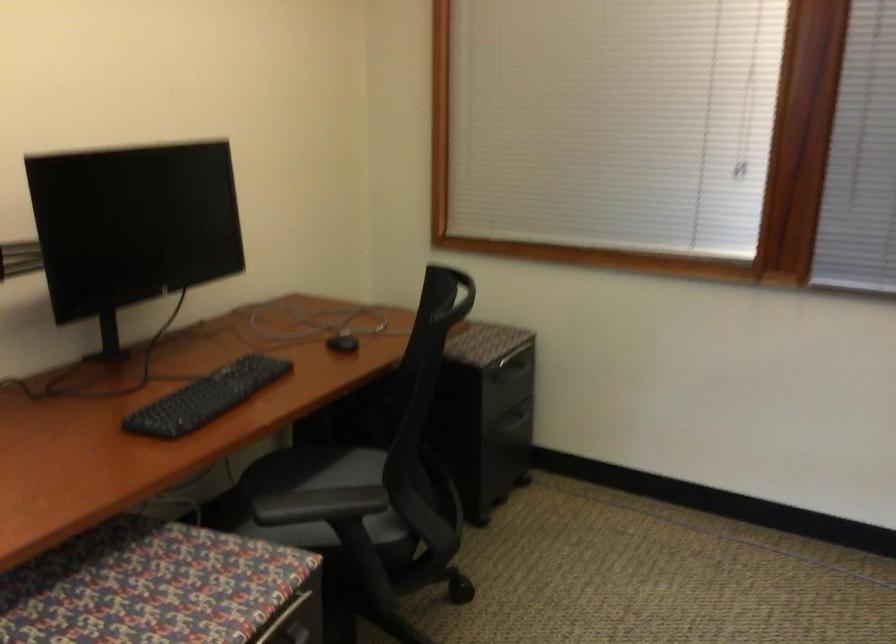
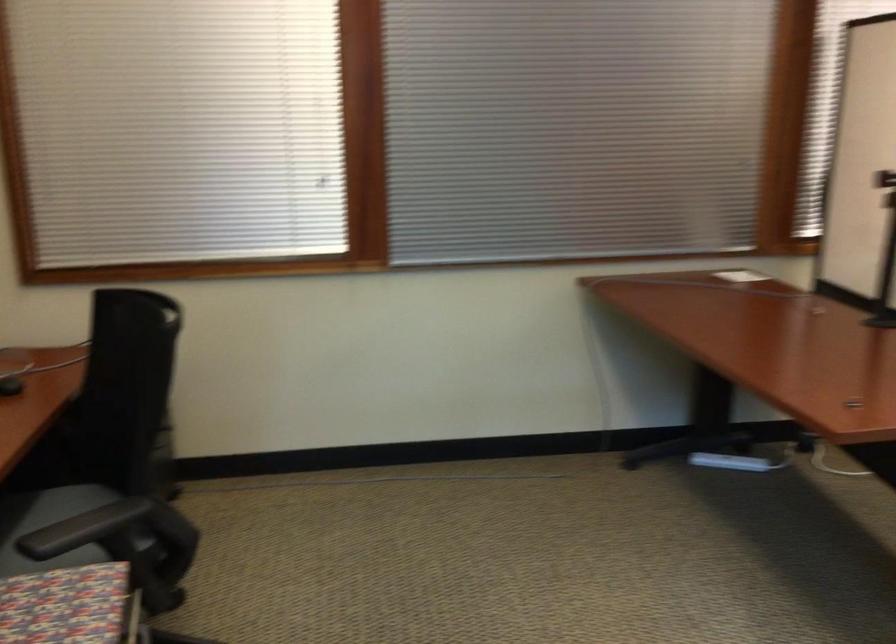
Where in the second image is the point corresponding to (x=330, y=339) from the first image?

(10, 384)